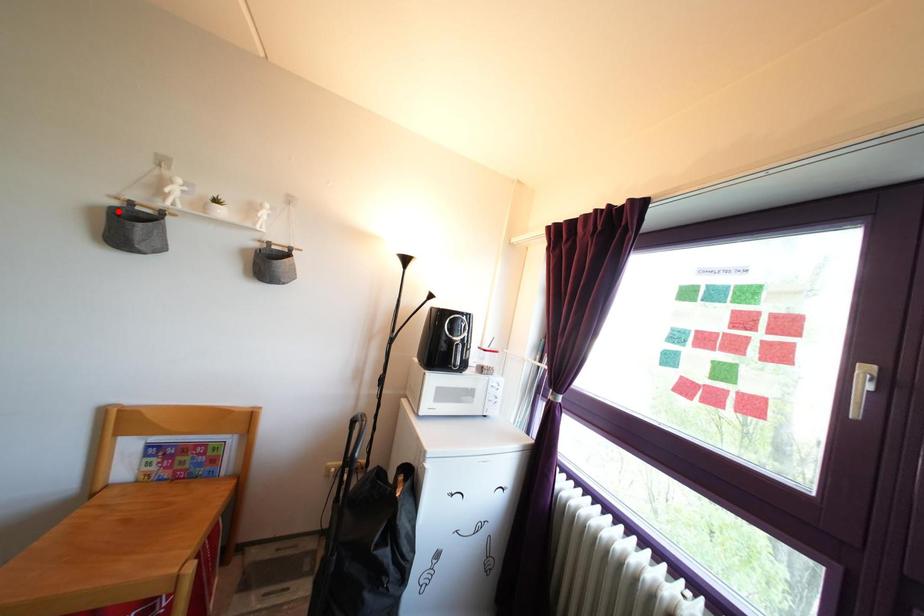
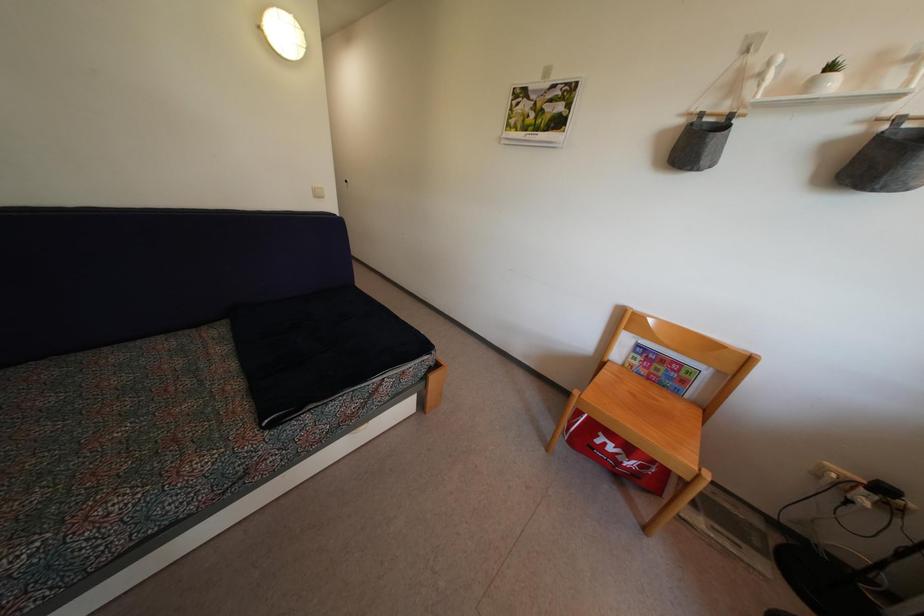
Locate, in the second image, the point that corresponds to the highlighted location in the first image.

(685, 129)